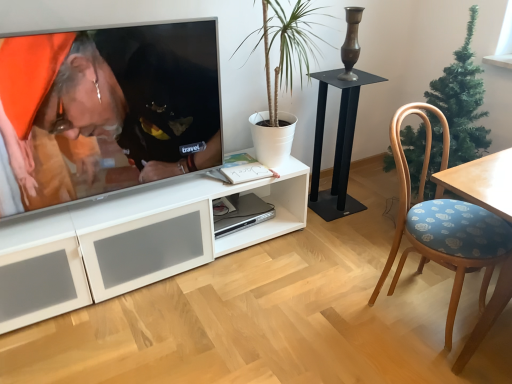
Identify the location of vacant space behind wooden chair with blue floral cushion at right. (369, 251).